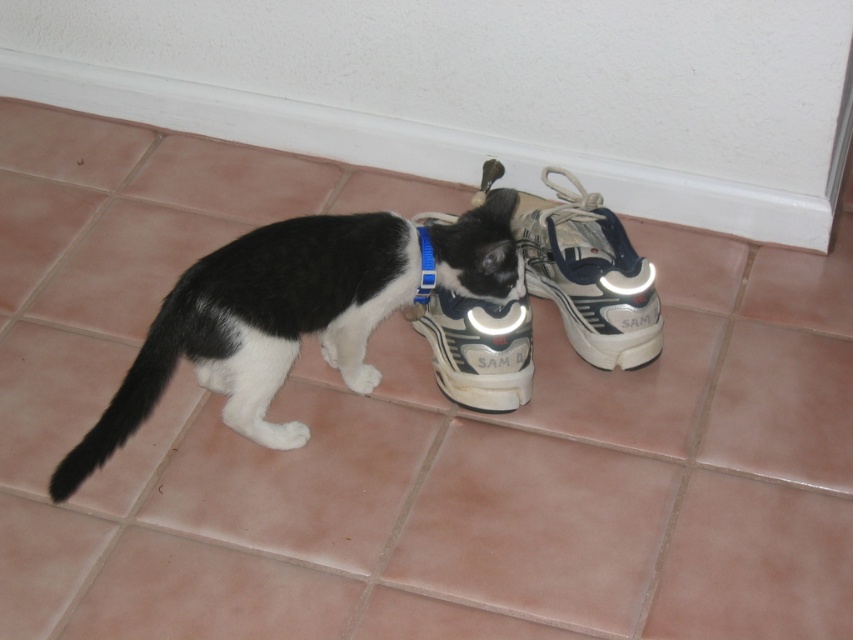
Question: Which point is farther to the camera?

Choices:
 (A) black matte/synthetic cat at center
 (B) white matte shoe at center

Answer: (B)

Question: Which point is closer to the camera?

Choices:
 (A) white matte shoe at center
 (B) blue fabric neckband at center

Answer: (B)

Question: Based on their relative distances, which object is nearer to the white synthetic shoe at center?

Choices:
 (A) blue fabric neckband at center
 (B) white matte shoe at center

Answer: (B)

Question: From the image, what is the correct spatial relationship of white synthetic shoe at center in relation to white matte shoe at center?

Choices:
 (A) above
 (B) below

Answer: (A)

Question: Can you confirm if white matte shoe at center is positioned to the left of blue fabric neckband at center?

Choices:
 (A) no
 (B) yes

Answer: (A)

Question: Can you confirm if white matte shoe at center is positioned to the left of blue fabric neckband at center?

Choices:
 (A) no
 (B) yes

Answer: (A)